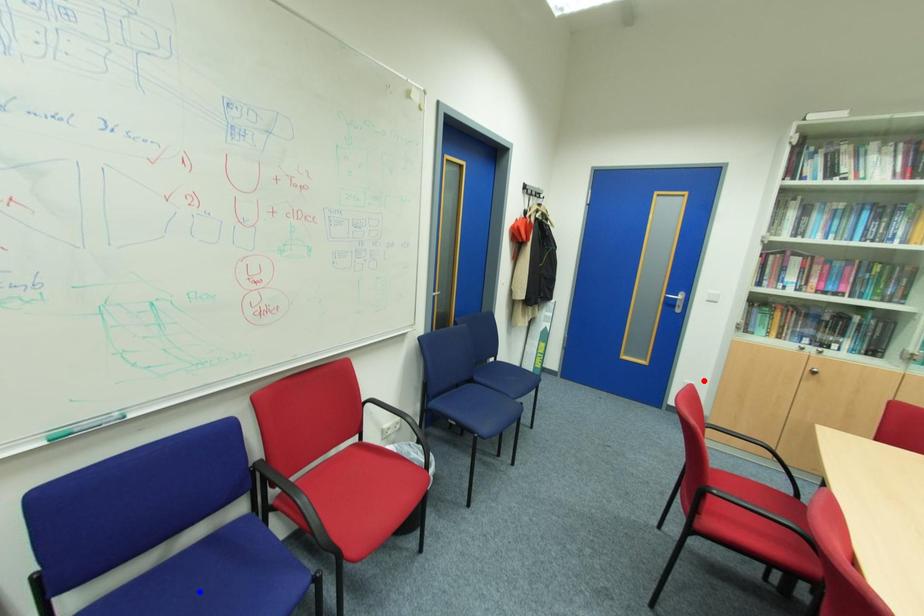
Question: Which of the two points in the image is closer to the camera?

Choices:
 (A) Blue point is closer.
 (B) Red point is closer.

Answer: (A)